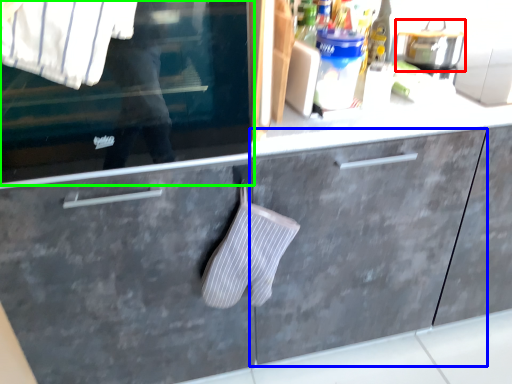
Question: Which object is the closest to the appliance (highlighted by a red box)? Choose among these: cabinetry (highlighted by a blue box) or window (highlighted by a green box).

Choices:
 (A) cabinetry
 (B) window

Answer: (A)